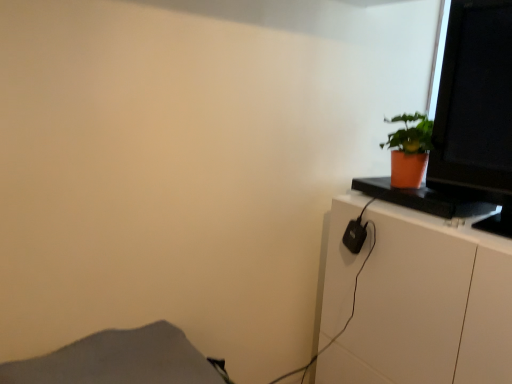
Question: Is white glossy cabinet at right wider or thinner than matte black monitor at upper right?

Choices:
 (A) wide
 (B) thin

Answer: (A)

Question: Considering the relative positions of white glossy cabinet at right and matte black monitor at upper right in the image provided, is white glossy cabinet at right to the left or to the right of matte black monitor at upper right?

Choices:
 (A) left
 (B) right

Answer: (A)

Question: Which object is positioned farthest from the white glossy cabinet at right?

Choices:
 (A) gray fabric at lower left
 (B) matte black monitor at upper right
 (C) orange matte pot at upper right

Answer: (A)

Question: Based on their relative distances, which object is nearer to the gray fabric at lower left?

Choices:
 (A) orange matte pot at upper right
 (B) matte black monitor at upper right
 (C) white glossy cabinet at right

Answer: (C)